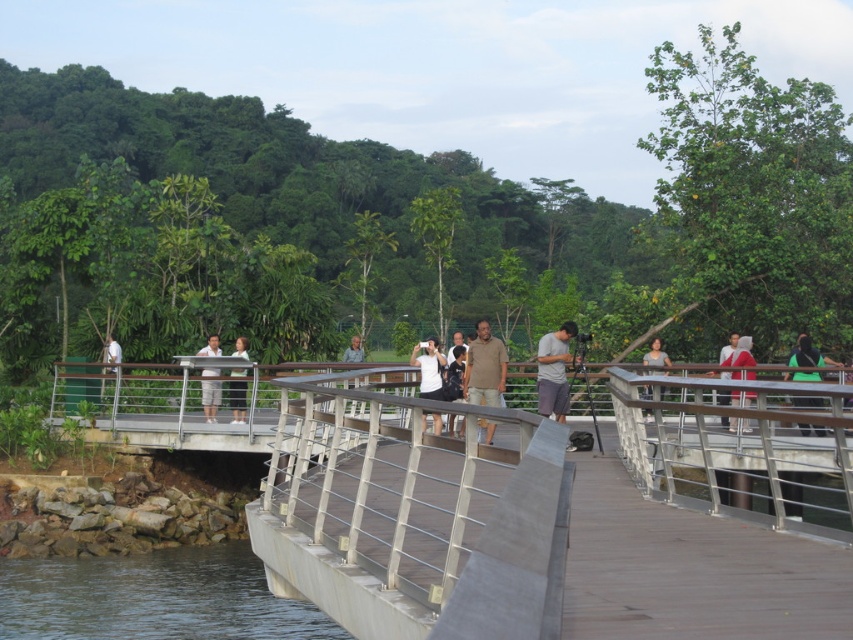
Can you confirm if white cotton shirt at center is positioned to the left of light blue shirt at center?

No, white cotton shirt at center is not to the left of light blue shirt at center.

Measure the distance from white cotton shirt at center to light blue shirt at center.

white cotton shirt at center and light blue shirt at center are 29.68 feet apart from each other.

Locate an element on the screen. The image size is (853, 640). white cotton shirt at center is located at coordinates (741, 353).

At what (x,y) coordinates should I click in order to perform the action: click on white cotton shirt at center. Please return your answer as a coordinate pair (x, y). Looking at the image, I should click on (741, 353).

Describe the element at coordinates (805, 355) in the screenshot. This screenshot has width=853, height=640. I see `green matte shirt at upper right` at that location.

Between green matte shirt at upper right and white cotton shirt at center, which one has less height?

Standing shorter between the two is white cotton shirt at center.

The height and width of the screenshot is (640, 853). In order to click on green matte shirt at upper right in this screenshot , I will do tap(805, 355).

Locate an element on the screen. green matte shirt at upper right is located at coordinates (805, 355).

Does white cotton shirt at center have a smaller size compared to white shirt at center?

Yes.

Is white cotton shirt at center thinner than white shirt at center?

No, white cotton shirt at center is not thinner than white shirt at center.

Who is more forward, [738,378] or [459,380]?

Positioned in front is point [459,380].

The width and height of the screenshot is (853, 640). Find the location of `white cotton shirt at center`. white cotton shirt at center is located at coordinates (741, 353).